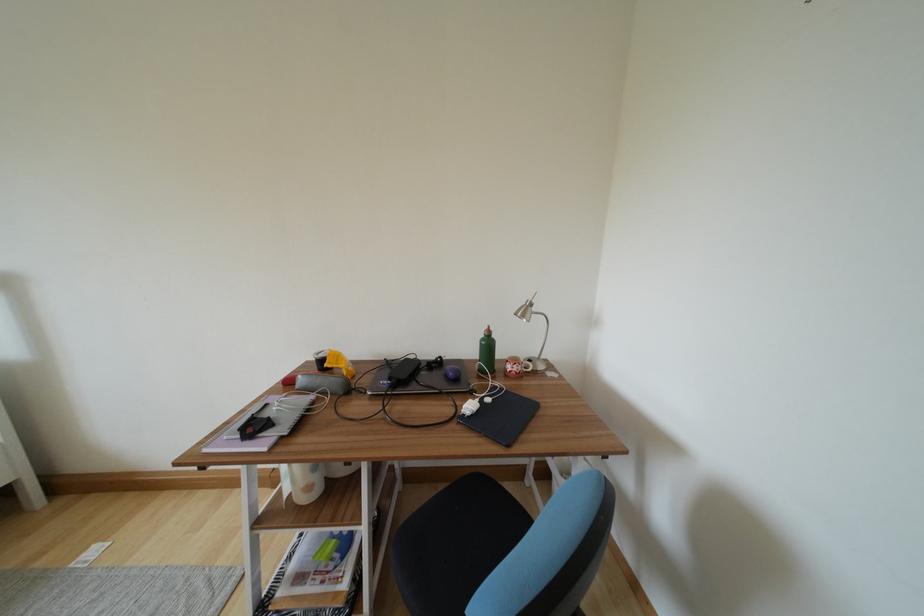
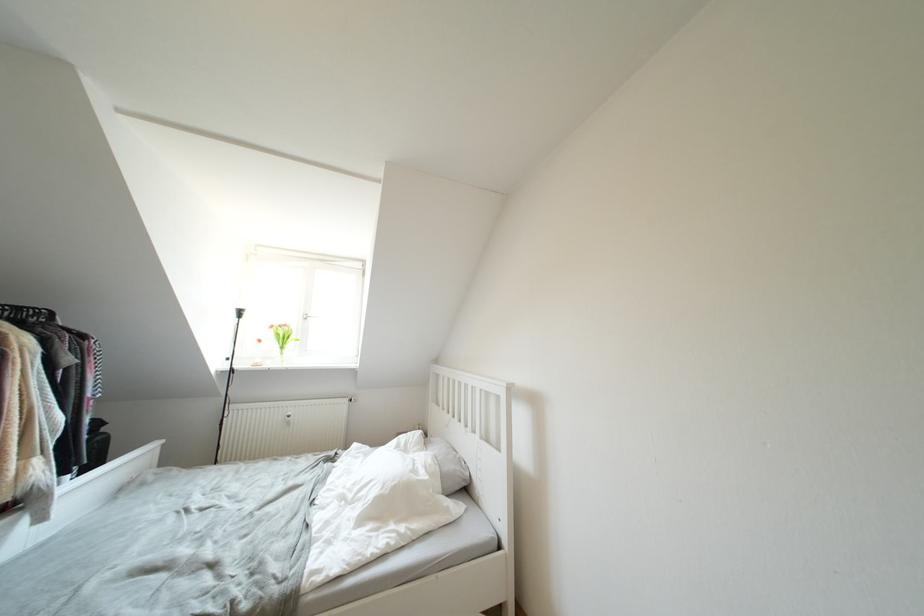
Question: How did the camera likely rotate?

Choices:
 (A) Left
 (B) Right
 (C) Up
 (D) Down

Answer: (A)